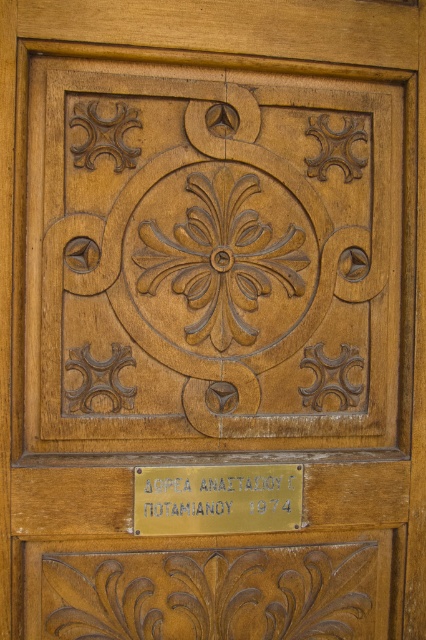
Question: Is wooden carved design at center to the right of gold metallic plaque at center from the viewer's perspective?

Choices:
 (A) no
 (B) yes

Answer: (B)

Question: Which is farther from the brown carved flower at center?

Choices:
 (A) gold metallic plaque at center
 (B) wooden carved design at center

Answer: (A)

Question: Among these points, which one is nearest to the camera?

Choices:
 (A) (219, 260)
 (B) (293, 525)
 (C) (230, 252)

Answer: (A)

Question: Which object is the closest to the brown carved flower at center?

Choices:
 (A) wooden carved design at center
 (B) gold metallic plaque at center

Answer: (A)

Question: Does wooden carved design at center appear on the left side of gold metallic plaque at center?

Choices:
 (A) no
 (B) yes

Answer: (A)

Question: Is wooden carved design at center bigger than gold metallic plaque at center?

Choices:
 (A) yes
 (B) no

Answer: (A)